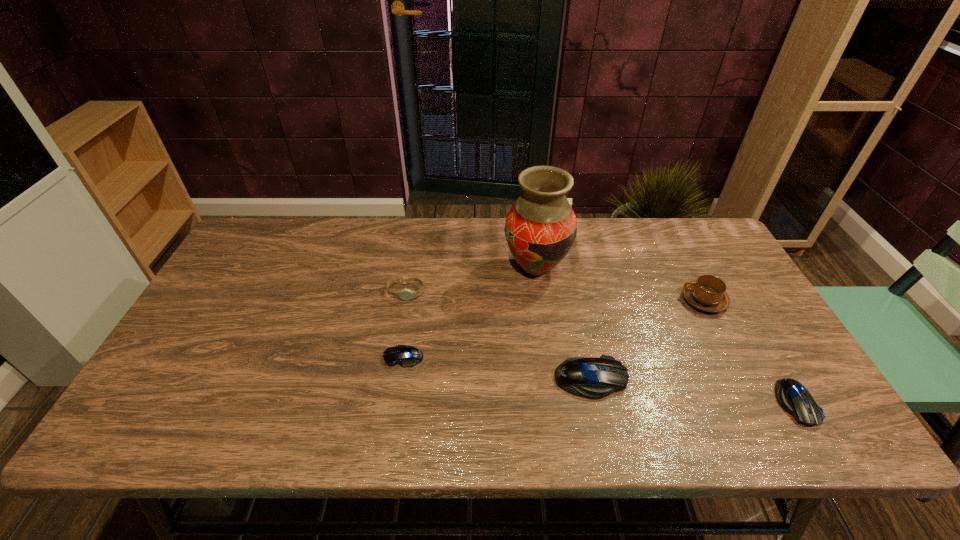
Please point a vacant point for placing a computer mouse on the left. Please provide its 2D coordinates. Your answer should be formatted as a tuple, i.e. [(x, y)], where the tuple contains the x and y coordinates of a point satisfying the conditions above.

[(231, 336)]